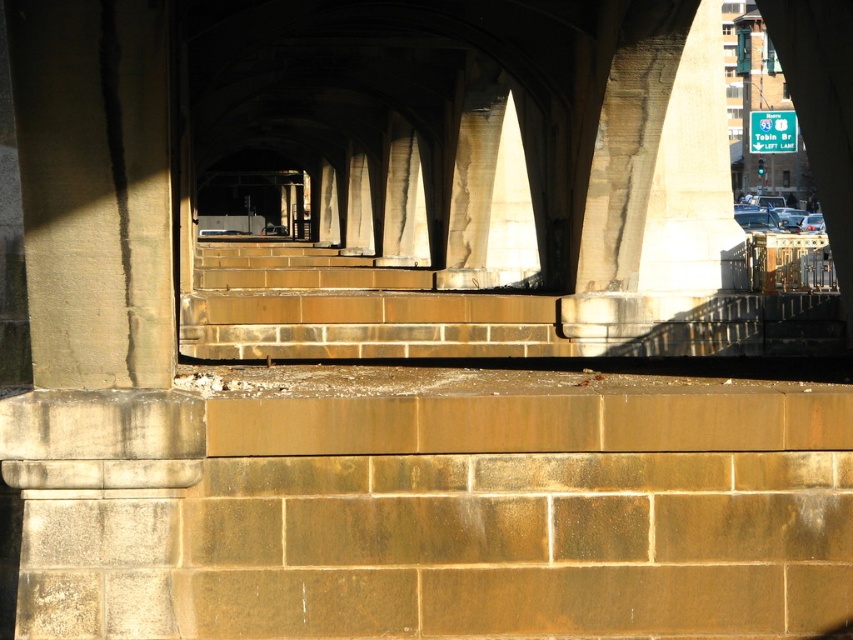
Who is positioned more to the left, brown stone stairs at center or green plastic sign at upper right?

From the viewer's perspective, brown stone stairs at center appears more on the left side.

What do you see at coordinates (465, 314) in the screenshot?
I see `brown stone stairs at center` at bounding box center [465, 314].

Who is more forward, [291,326] or [792,122]?

Point [291,326] is in front.

Image resolution: width=853 pixels, height=640 pixels. I want to click on brown stone stairs at center, so click(x=465, y=314).